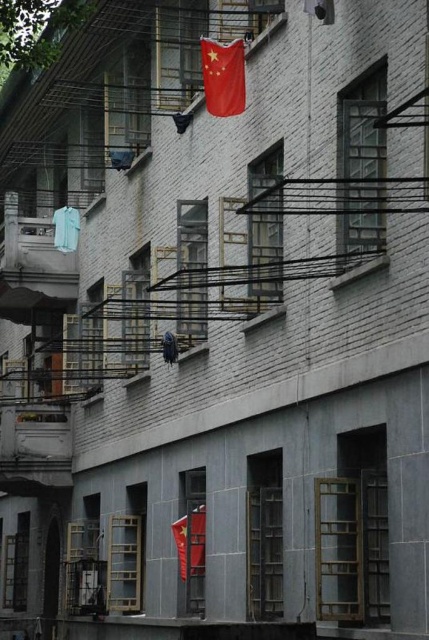
Question: Which point appears farthest from the camera in this image?

Choices:
 (A) (202, 568)
 (B) (204, 61)

Answer: (A)

Question: Is red fabric flag at center thinner than light blue fabric at left?

Choices:
 (A) no
 (B) yes

Answer: (B)

Question: Which point is closer to the camera?

Choices:
 (A) (68, 205)
 (B) (201, 536)
 (C) (171, 333)
 (D) (208, 61)

Answer: (D)

Question: Where is red fabric flag at upper center located in relation to blue fabric at center in the image?

Choices:
 (A) left
 (B) right

Answer: (B)

Question: Estimate the real-world distances between objects in this image. Which object is closer to the red fabric flag at center?

Choices:
 (A) red fabric flag at upper center
 (B) light blue fabric at left
 (C) blue fabric at center

Answer: (C)

Question: Is red fabric flag at center further to the viewer compared to blue fabric at center?

Choices:
 (A) yes
 (B) no

Answer: (B)